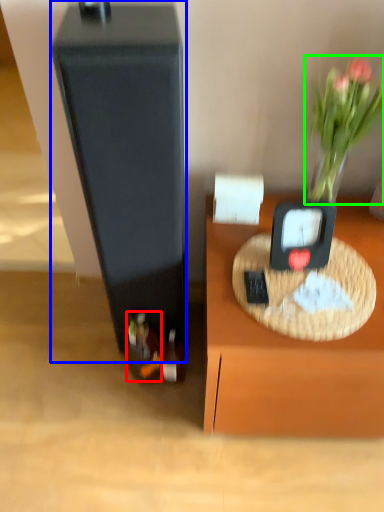
Question: Considering the real-world distances, which object is farthest from wine bottle (highlighted by a red box)? wide (highlighted by a blue box) or plant (highlighted by a green box)?

Choices:
 (A) wide
 (B) plant

Answer: (B)